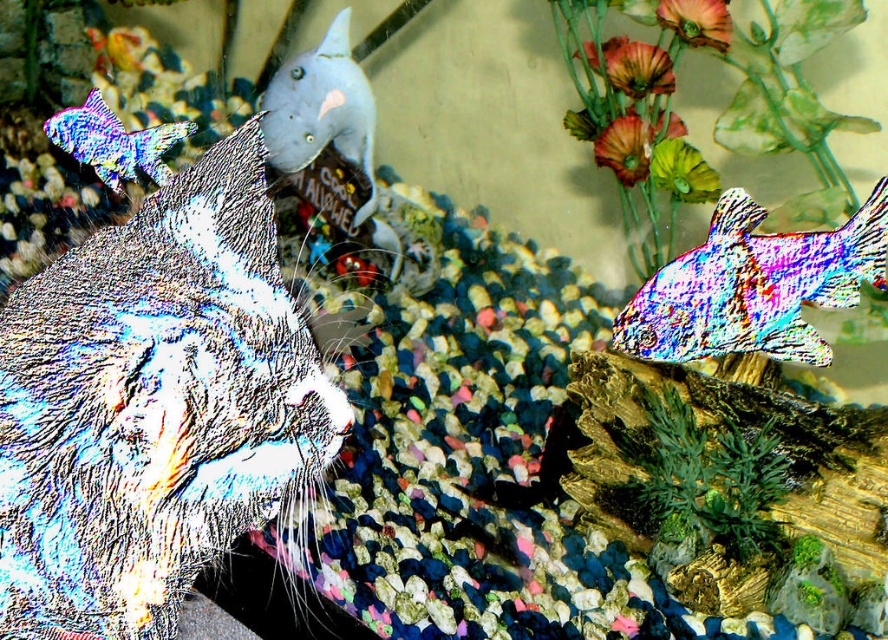
You are a fish in the tank and want to swim towards the nearest object. Which object should you choose between the matte gray fish at upper center and the shiny metallic fish at upper left?

The shiny metallic fish at upper left is closer because the matte gray fish at upper center is positioned over it, meaning it is further away.

You are a gardener who wants to plant two flowers in a garden bed. You have the matte pink flower at upper center and the green matte flower at upper right. According to their positions in the image, which flower should you place on the left side of the garden bed?

The matte pink flower at upper center should be placed on the left side of the garden bed since it is positioned to the left of the green matte flower at upper right in the image.

You are a cat staring at a fish tank. You want to catch the shiny iridescent fish at right and the matte gray fish at upper center. Which fish is closer to your paws?

The shiny iridescent fish at right is located below matte gray fish at upper center, so the shiny iridescent fish at right is closer to your paws.